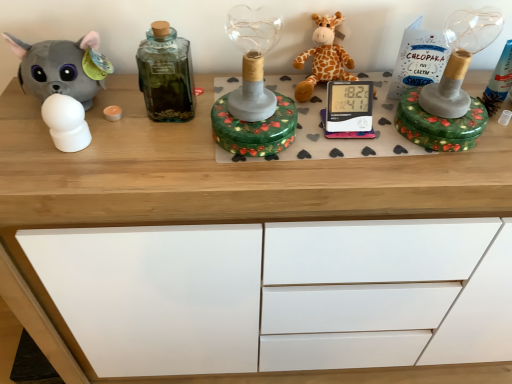
What is the approximate width of matte gray plush toy at left, the 1th toy when ordered from left to right?

It is 5.77 inches.

Locate an element on the screen. The height and width of the screenshot is (384, 512). orange plush giraffe at center, acting as the second toy starting from the left is located at coordinates (324, 57).

Can you confirm if orange plush giraffe at center, the first toy in the right-to-left sequence, is thinner than green glass bottle at center?

No, orange plush giraffe at center, the first toy in the right-to-left sequence, is not thinner than green glass bottle at center.

Can you tell me how much orange plush giraffe at center, acting as the second toy starting from the left, and green glass bottle at center differ in facing direction?

The facing directions of orange plush giraffe at center, acting as the second toy starting from the left, and green glass bottle at center are 4.64e-05 degrees apart.

Considering the relative sizes of orange plush giraffe at center, acting as the second toy starting from the left, and green glass bottle at center in the image provided, is orange plush giraffe at center, acting as the second toy starting from the left, shorter than green glass bottle at center?

Yes.

Considering the positions of points (318, 50) and (174, 94), is point (318, 50) farther from camera compared to point (174, 94)?

Yes, point (318, 50) is behind point (174, 94).

From a real-world perspective, between matte gray plush toy at left, the 1th toy when ordered from left to right, and green glass bottle at center, who is vertically lower?

matte gray plush toy at left, the 1th toy when ordered from left to right, is physically lower.

Does matte gray plush toy at left, the 1th toy when ordered from left to right, lie behind green glass bottle at center?

Yes, matte gray plush toy at left, the 1th toy when ordered from left to right, is further from the viewer.

Considering the positions of point (88, 36) and point (190, 94), is point (88, 36) closer or farther from the camera than point (190, 94)?

Point (88, 36) appears to be closer to the viewer than point (190, 94).

Is green glass bottle at center at the back of matte gray plush toy at left, the 2th toy when ordered from right to left?

matte gray plush toy at left, the 2th toy when ordered from right to left, does not have its back to green glass bottle at center.

In the scene shown: Considering the positions of objects green glass bottle at center and orange plush giraffe at center, the first toy in the right-to-left sequence, in the image provided, who is more to the left, green glass bottle at center or orange plush giraffe at center, the first toy in the right-to-left sequence,?

Positioned to the left is green glass bottle at center.

Between point (149, 108) and point (330, 55), which one is positioned in front?

The point (149, 108) is closer to the camera.

Are green glass bottle at center and orange plush giraffe at center, the first toy in the right-to-left sequence, making contact?

No, green glass bottle at center is not touching orange plush giraffe at center, the first toy in the right-to-left sequence.

Is green glass bottle at center located outside orange plush giraffe at center, the first toy in the right-to-left sequence?

Indeed, green glass bottle at center is completely outside orange plush giraffe at center, the first toy in the right-to-left sequence.

Considering the positions of objects green glass bottle at center and matte gray plush toy at left, the 2th toy when ordered from right to left, in the image provided, who is behind, green glass bottle at center or matte gray plush toy at left, the 2th toy when ordered from right to left,?

Positioned behind is matte gray plush toy at left, the 2th toy when ordered from right to left.

Image resolution: width=512 pixels, height=384 pixels. Identify the location of bottle lying in front of the matte gray plush toy at left, the 1th toy when ordered from left to right. (166, 74).

Considering the relative positions of matte gray plush toy at left, the 2th toy when ordered from right to left, and orange plush giraffe at center, the first toy in the right-to-left sequence, in the image provided, is matte gray plush toy at left, the 2th toy when ordered from right to left, to the left of orange plush giraffe at center, the first toy in the right-to-left sequence, from the viewer's perspective?

Indeed, matte gray plush toy at left, the 2th toy when ordered from right to left, is positioned on the left side of orange plush giraffe at center, the first toy in the right-to-left sequence.

Considering the relative sizes of matte gray plush toy at left, the 2th toy when ordered from right to left, and orange plush giraffe at center, acting as the second toy starting from the left, in the image provided, is matte gray plush toy at left, the 2th toy when ordered from right to left, wider than orange plush giraffe at center, acting as the second toy starting from the left,?

In fact, matte gray plush toy at left, the 2th toy when ordered from right to left, might be narrower than orange plush giraffe at center, acting as the second toy starting from the left.

Considering the relative positions of matte gray plush toy at left, the 1th toy when ordered from left to right, and orange plush giraffe at center, acting as the second toy starting from the left, in the image provided, is matte gray plush toy at left, the 1th toy when ordered from left to right, behind orange plush giraffe at center, acting as the second toy starting from the left,?

No.

Can you confirm if matte gray plush toy at left, the 2th toy when ordered from right to left, is smaller than orange plush giraffe at center, the first toy in the right-to-left sequence?

Incorrect, matte gray plush toy at left, the 2th toy when ordered from right to left, is not smaller in size than orange plush giraffe at center, the first toy in the right-to-left sequence.

Are orange plush giraffe at center, the first toy in the right-to-left sequence, and matte gray plush toy at left, the 2th toy when ordered from right to left, located far from each other?

No, orange plush giraffe at center, the first toy in the right-to-left sequence, is not far away from matte gray plush toy at left, the 2th toy when ordered from right to left.

From the image's perspective, is orange plush giraffe at center, acting as the second toy starting from the left, positioned above or below matte gray plush toy at left, the 1th toy when ordered from left to right?

orange plush giraffe at center, acting as the second toy starting from the left, is above matte gray plush toy at left, the 1th toy when ordered from left to right.

Between point (306, 92) and point (69, 86), which one is positioned behind?

The point (306, 92) is farther from the camera.

Is orange plush giraffe at center, acting as the second toy starting from the left, situated inside matte gray plush toy at left, the 2th toy when ordered from right to left, or outside?

orange plush giraffe at center, acting as the second toy starting from the left, is not inside matte gray plush toy at left, the 2th toy when ordered from right to left, it's outside.

Where is `the 2nd toy behind the green glass bottle at center, starting your count from the anchor`? the 2nd toy behind the green glass bottle at center, starting your count from the anchor is located at coordinates tap(324, 57).

The image size is (512, 384). I want to click on toy on the left of the green glass bottle at center, so click(62, 67).

Which object lies further to the anchor point matte gray plush toy at left, the 2th toy when ordered from right to left, orange plush giraffe at center, acting as the second toy starting from the left, or green glass bottle at center?

The object further to matte gray plush toy at left, the 2th toy when ordered from right to left, is orange plush giraffe at center, acting as the second toy starting from the left.

Considering their positions, is matte gray plush toy at left, the 2th toy when ordered from right to left, positioned closer to orange plush giraffe at center, acting as the second toy starting from the left, than green glass bottle at center?

green glass bottle at center.

Based on their spatial positions, is matte gray plush toy at left, the 1th toy when ordered from left to right, or orange plush giraffe at center, acting as the second toy starting from the left, further from green glass bottle at center?

Based on the image, orange plush giraffe at center, acting as the second toy starting from the left, appears to be further to green glass bottle at center.

From the image, which object appears to be nearer to orange plush giraffe at center, the first toy in the right-to-left sequence, green glass bottle at center or matte gray plush toy at left, the 2th toy when ordered from right to left?

green glass bottle at center is positioned closer to the anchor orange plush giraffe at center, the first toy in the right-to-left sequence.

When comparing their distances from green glass bottle at center, does orange plush giraffe at center, the first toy in the right-to-left sequence, or matte gray plush toy at left, the 2th toy when ordered from right to left, seem closer?

matte gray plush toy at left, the 2th toy when ordered from right to left, lies closer to green glass bottle at center than the other object.

From the image, which object appears to be nearer to matte gray plush toy at left, the 1th toy when ordered from left to right, green glass bottle at center or orange plush giraffe at center, the first toy in the right-to-left sequence?

green glass bottle at center is positioned closer to the anchor matte gray plush toy at left, the 1th toy when ordered from left to right.

The image size is (512, 384). Identify the location of bottle between matte gray plush toy at left, the 1th toy when ordered from left to right, and orange plush giraffe at center, the first toy in the right-to-left sequence, from left to right. (166, 74).